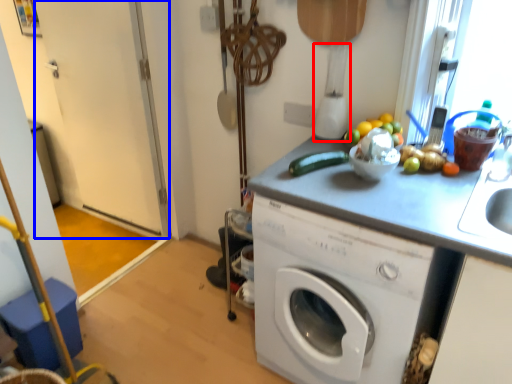
Question: Which object is further to the camera taking this photo, blender (highlighted by a red box) or screen door (highlighted by a blue box)?

Choices:
 (A) blender
 (B) screen door

Answer: (B)